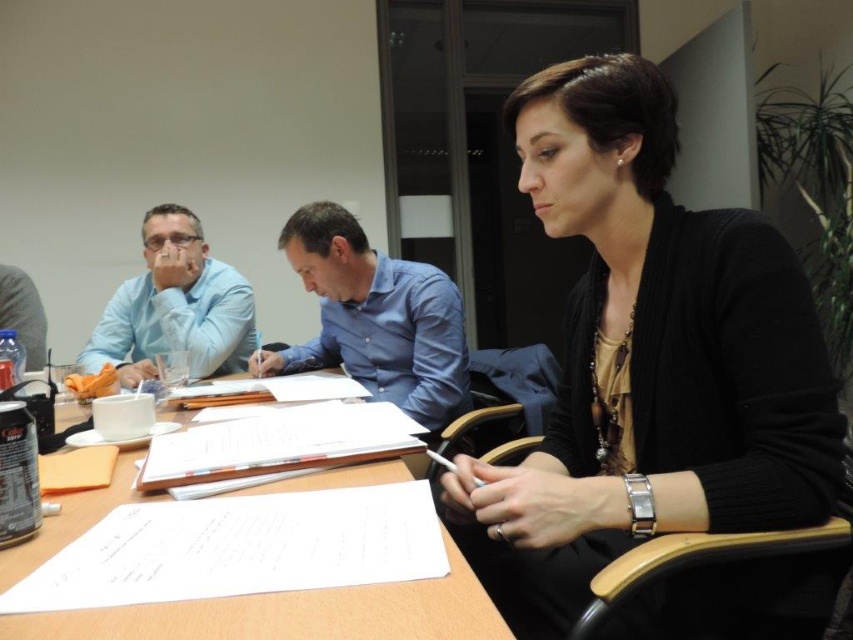
You are a person who is 5 feet 6 inches tall. You are sitting at the wooden table at center and want to reach the black matte cardigan at center. Can you easily reach it from your seated position?

The black matte cardigan at center is only 13.88 inches away from the wooden table at center, so yes, you can easily reach it from your seated position.